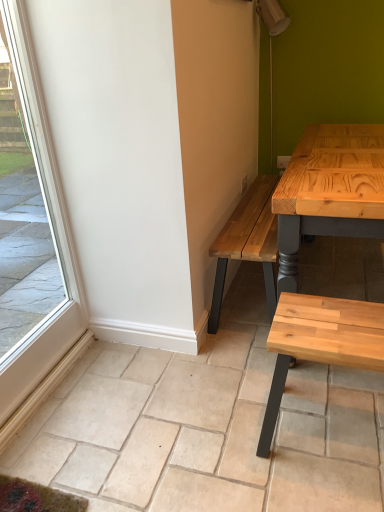
This screenshot has height=512, width=384. I want to click on vacant location below natural wood bench at lower right (from a real-world perspective), so click(x=330, y=425).